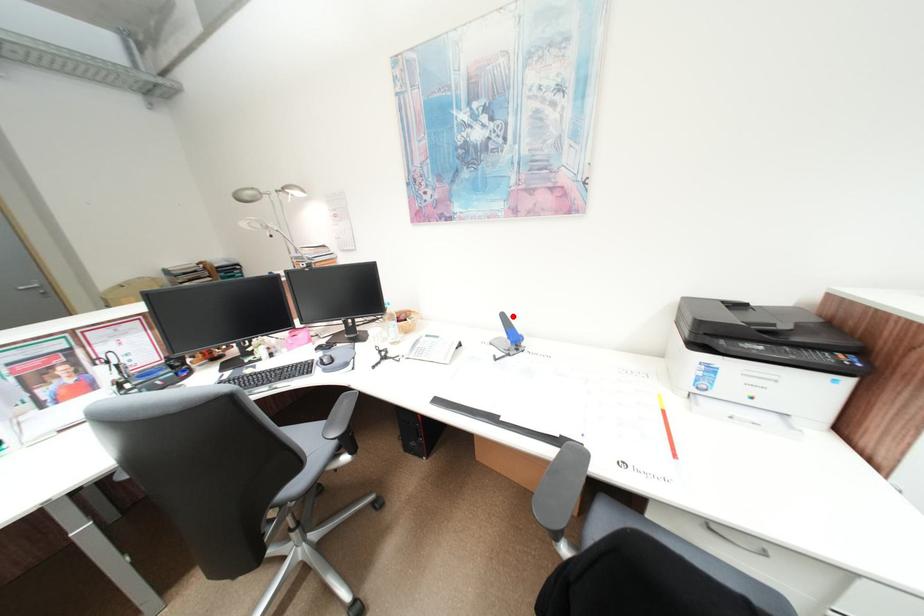
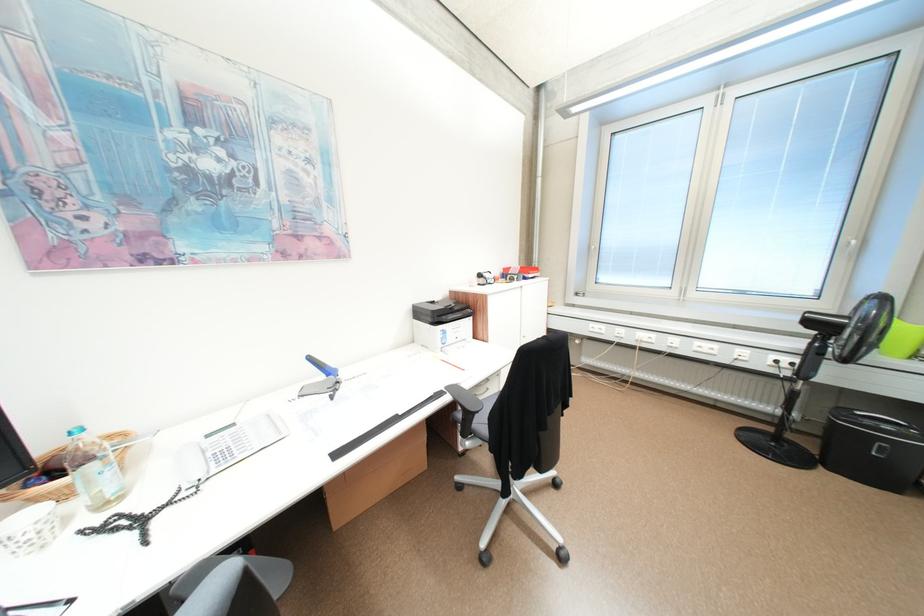
In the second image, find the point that corresponds to the highlighted location in the first image.

(320, 359)